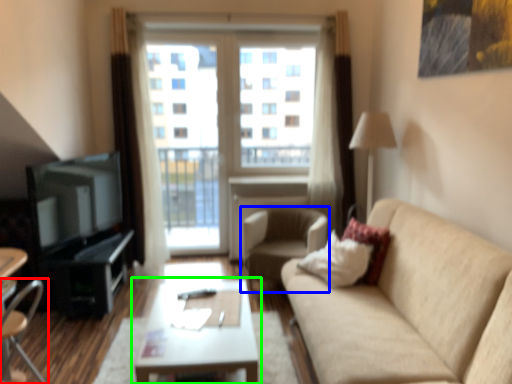
Question: Which is nearer to the chair (highlighted by a red box)? chair (highlighted by a blue box) or coffee table (highlighted by a green box).

Choices:
 (A) chair
 (B) coffee table

Answer: (B)